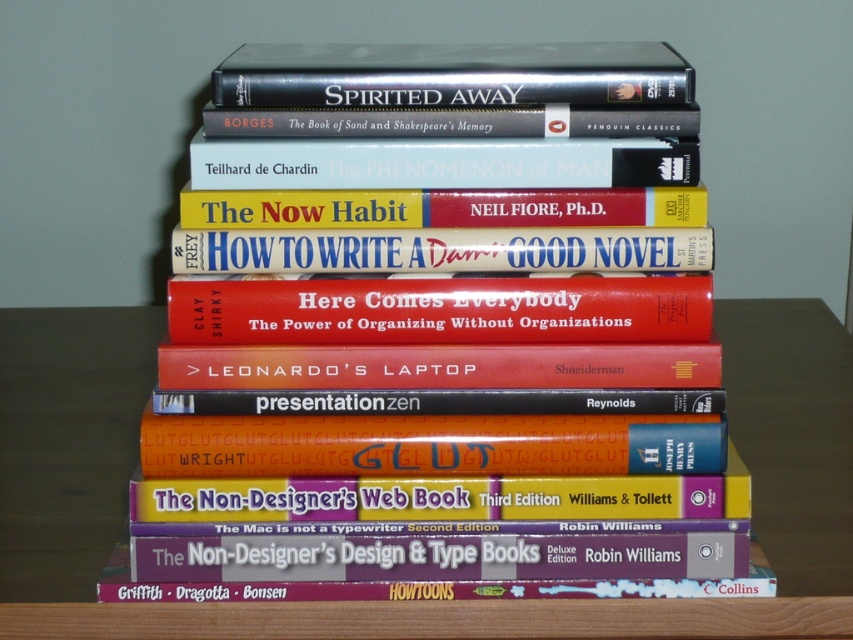
Question: Considering the relative positions of matte red book at center and hardcover book at center in the image provided, where is matte red book at center located with respect to hardcover book at center?

Choices:
 (A) above
 (B) below

Answer: (B)

Question: Based on their relative distances, which object is farther from the white paper book at center?

Choices:
 (A) yellow matte book at center
 (B) hardcover book at center
 (C) wooden table at center

Answer: (C)

Question: Can you confirm if white paper book at center is bigger than yellow matte book at center?

Choices:
 (A) yes
 (B) no

Answer: (A)

Question: Does wooden table at center lie behind metallic silver dvd at upper center?

Choices:
 (A) yes
 (B) no

Answer: (A)

Question: Which point appears closest to the camera in this image?

Choices:
 (A) (373, 99)
 (B) (114, 508)
 (C) (700, 326)
 (D) (357, 148)

Answer: (D)

Question: Estimate the real-world distances between objects in this image. Which object is farther from the yellow matte book at center?

Choices:
 (A) hardcover book at center
 (B) matte red book at center
 (C) hardcover books at center
 (D) red matte book at center

Answer: (C)